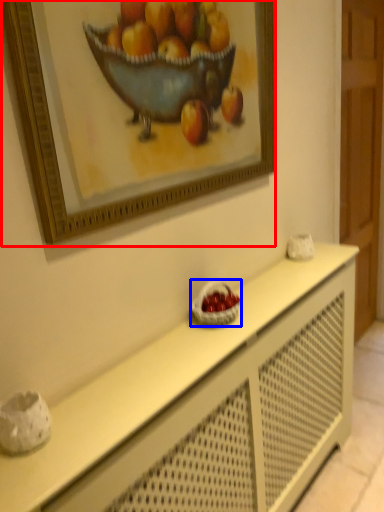
Question: Which point is further to the camera, picture frame (highlighted by a red box) or basket (highlighted by a blue box)?

Choices:
 (A) picture frame
 (B) basket

Answer: (B)